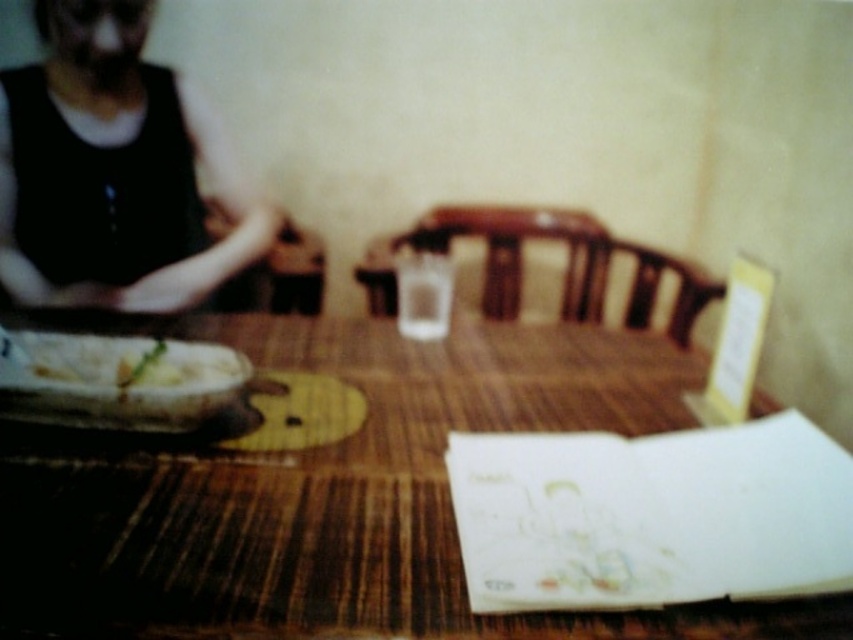
Question: Can you confirm if wooden table at center is wider than black fabric at left?

Choices:
 (A) no
 (B) yes

Answer: (B)

Question: Which of the following is the farthest from the observer?

Choices:
 (A) wooden table at center
 (B) black fabric at left

Answer: (B)

Question: Can you confirm if wooden table at center is positioned to the right of black fabric at left?

Choices:
 (A) yes
 (B) no

Answer: (A)

Question: Is wooden table at center to the right of black fabric at left from the viewer's perspective?

Choices:
 (A) yes
 (B) no

Answer: (A)